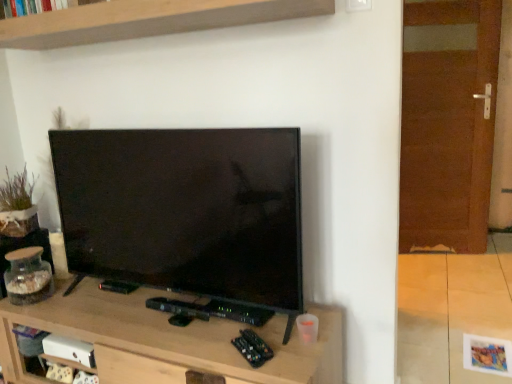
You are a GUI agent. You are given a task and a screenshot of the screen. Output one action in this format:
    pyautogui.click(x=<x>, y=<y>)
    Task: Click on the free area below brown wooden door at right (from a real-world perspective)
    This screenshot has width=512, height=384.
    Given the screenshot: What is the action you would take?
    pyautogui.click(x=442, y=249)